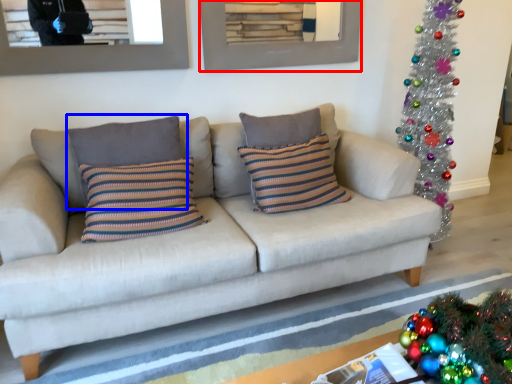
Question: Which object is closer to the camera taking this photo, picture frame (highlighted by a red box) or pillow (highlighted by a blue box)?

Choices:
 (A) picture frame
 (B) pillow

Answer: (B)